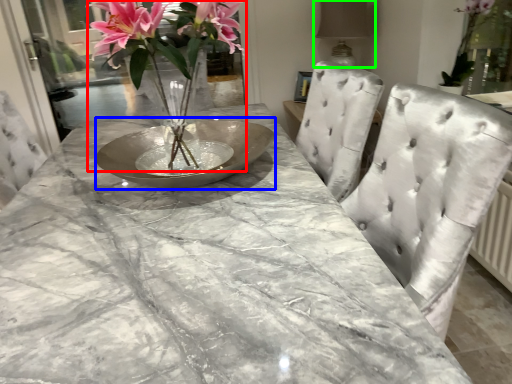
Question: Estimate the real-world distances between objects in this image. Which object is farther from floral arrangement (highlighted by a red box), glass plate (highlighted by a blue box) or lamp (highlighted by a green box)?

Choices:
 (A) glass plate
 (B) lamp

Answer: (B)